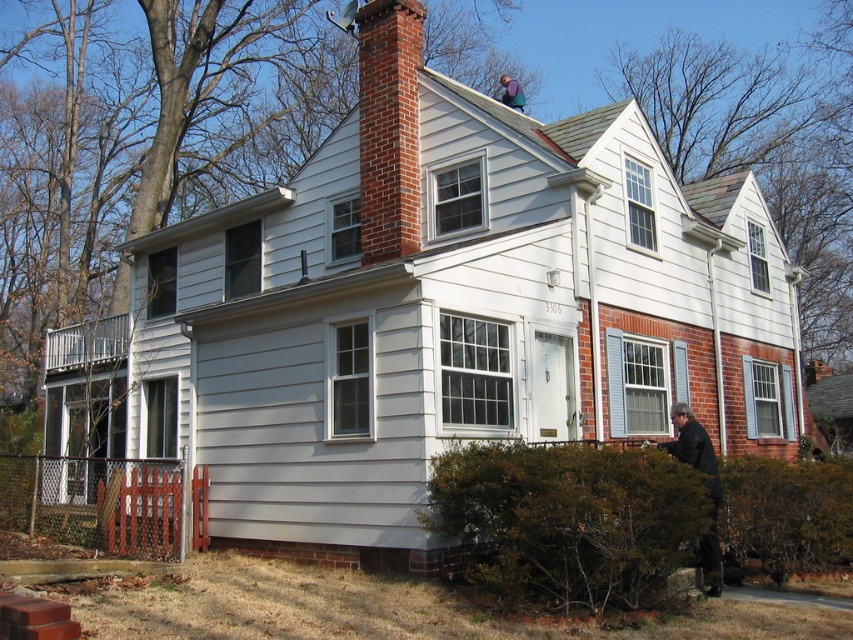
Question: Is brick chimney at center further to the viewer compared to dark gray jacket at lower right?

Choices:
 (A) yes
 (B) no

Answer: (A)

Question: Is brick chimney at center bigger than blue denim jacket at upper center?

Choices:
 (A) no
 (B) yes

Answer: (A)

Question: Can you confirm if brick chimney at center is positioned above dark gray jacket at lower right?

Choices:
 (A) yes
 (B) no

Answer: (A)

Question: Which is nearer to the blue denim jacket at upper center?

Choices:
 (A) dark gray jacket at lower right
 (B) brick chimney at center

Answer: (B)

Question: Based on their relative distances, which object is nearer to the dark gray jacket at lower right?

Choices:
 (A) brick chimney at center
 (B) blue denim jacket at upper center

Answer: (A)

Question: Which point is farther from the camera taking this photo?

Choices:
 (A) (381, 12)
 (B) (515, 88)
 (C) (677, 426)

Answer: (B)